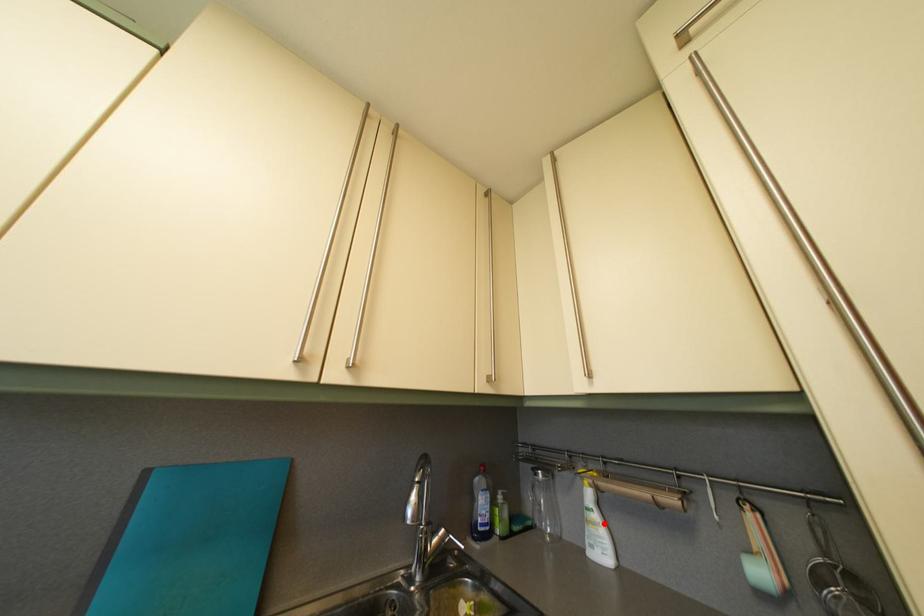
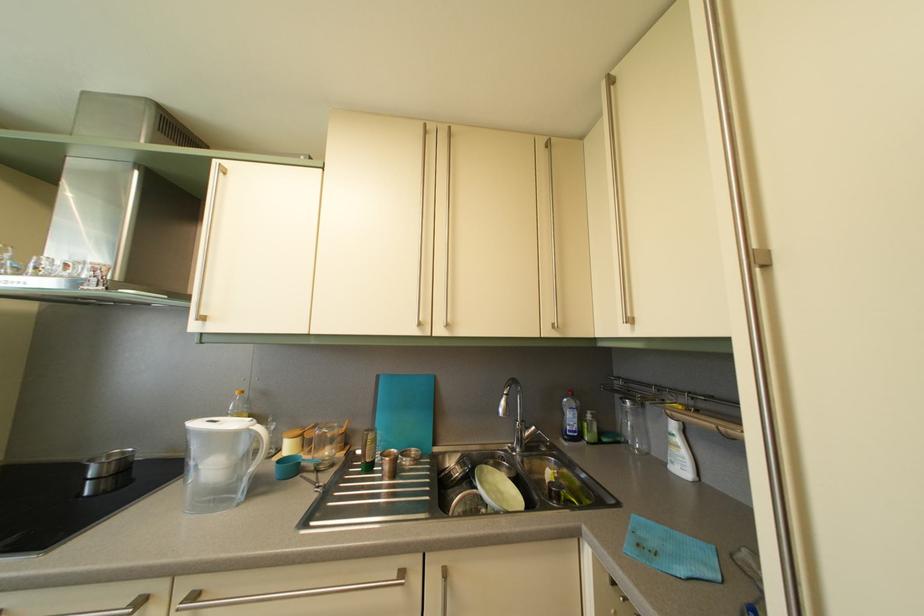
Question: I am providing you with two images of the same scene from different viewpoints. A red point is marked on the first image. Is the red point's position out of view in image 2?

Choices:
 (A) Yes
 (B) No

Answer: (B)